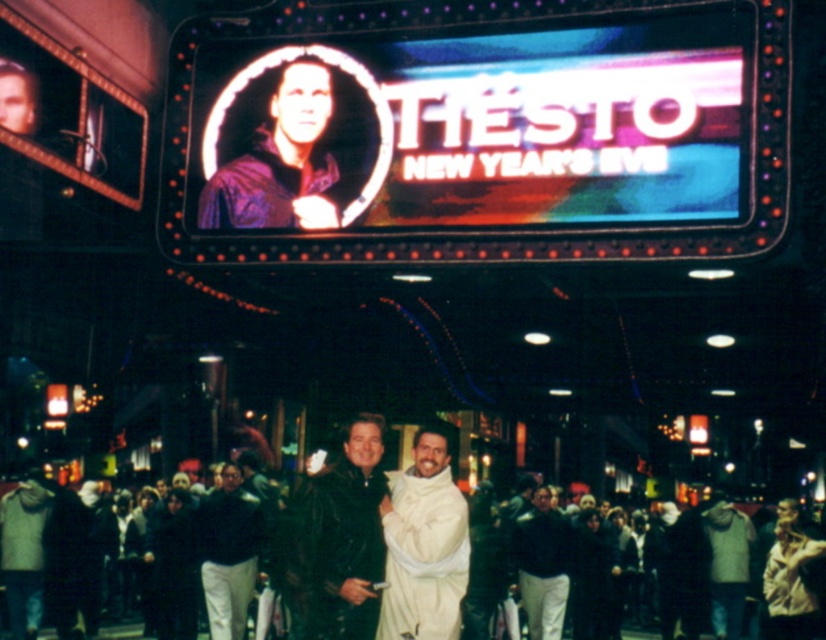
Question: Which object is positioned farthest from the dark blue jacket at center?

Choices:
 (A) white matte robe at center
 (B) shiny purple jacket at upper center
 (C) velvet black coat at center

Answer: (B)

Question: Is shiny purple jacket at upper center to the right of white matte robe at center from the viewer's perspective?

Choices:
 (A) no
 (B) yes

Answer: (A)

Question: Is velvet black coat at center to the left of dark blue jacket at center from the viewer's perspective?

Choices:
 (A) yes
 (B) no

Answer: (A)

Question: Which point is farther to the camera?

Choices:
 (A) velvet black coat at center
 (B) dark blue jacket at center
 (C) white matte robe at center

Answer: (B)

Question: Among these objects, which one is farthest from the camera?

Choices:
 (A) velvet black coat at center
 (B) dark gray fabric jacket at center
 (C) shiny purple jacket at upper center

Answer: (B)

Question: Can you confirm if velvet black coat at center is smaller than dark blue jacket at center?

Choices:
 (A) no
 (B) yes

Answer: (A)